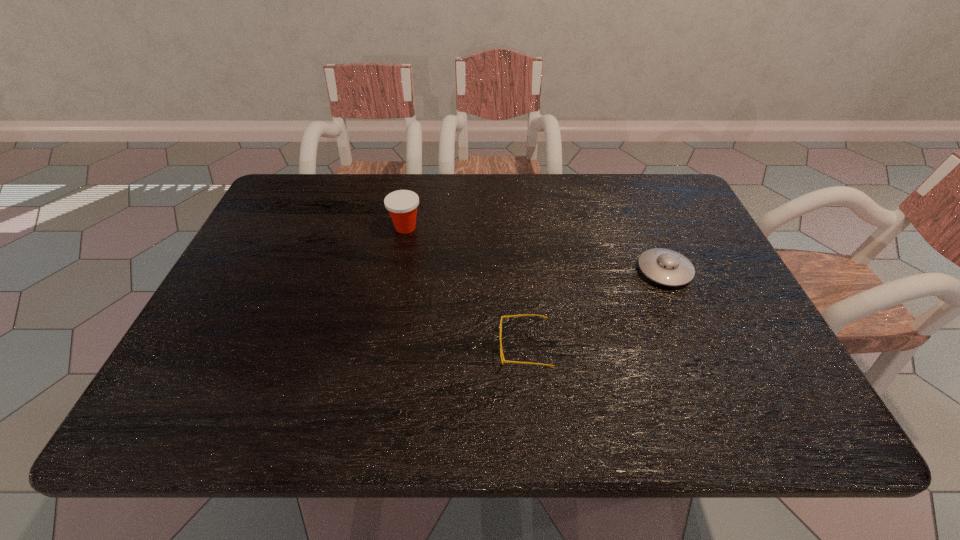
I want to click on the tallest object, so click(x=402, y=205).

Locate an element on the screen. This screenshot has width=960, height=540. Dixie cup is located at coordinates (402, 205).

Where is `the second nearest object`? The width and height of the screenshot is (960, 540). the second nearest object is located at coordinates (x=666, y=267).

This screenshot has width=960, height=540. In order to click on the rightmost object in this screenshot , I will do `click(666, 267)`.

At what (x,y) coordinates should I click in order to perform the action: click on the nearest object. Please return your answer as a coordinate pair (x, y). Looking at the image, I should click on (502, 317).

The width and height of the screenshot is (960, 540). In order to click on spectacles in this screenshot , I will do `click(502, 317)`.

The height and width of the screenshot is (540, 960). I want to click on vacant area located 0.080m on the back of the tallest object, so click(x=411, y=201).

Find the location of a particular element. The image size is (960, 540). vacant space situated 0.300m on the front of the saucer is located at coordinates (721, 403).

Locate an element on the screen. The image size is (960, 540). vacant region located 0.190m in front of the lenses of the second object from right to left is located at coordinates (410, 348).

You are a GUI agent. You are given a task and a screenshot of the screen. Output one action in this format:
    pyautogui.click(x=<x>, y=<y>)
    Task: Click on the vacant area located 0.300m in front of the lenses of the second object from right to left
    
    Given the screenshot: What is the action you would take?
    pyautogui.click(x=358, y=348)